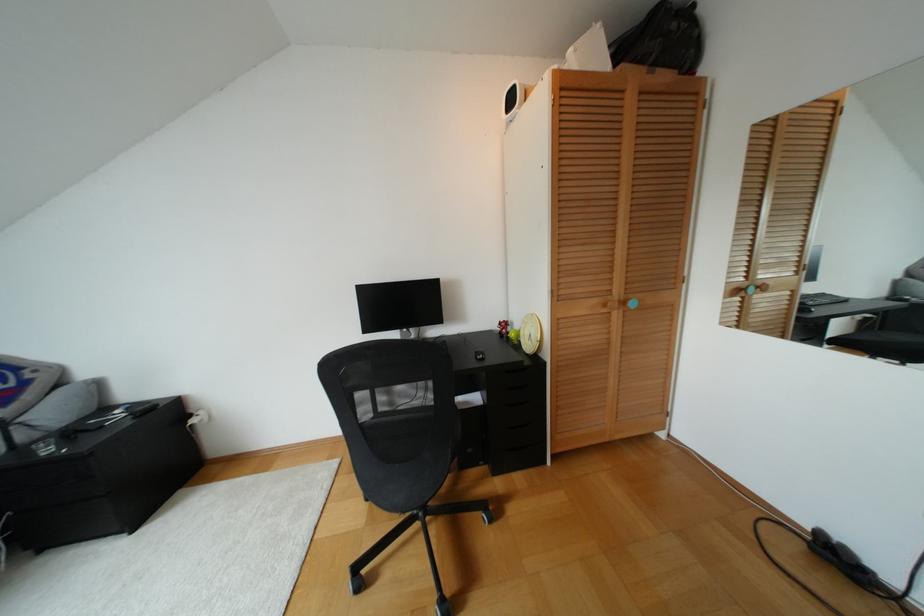
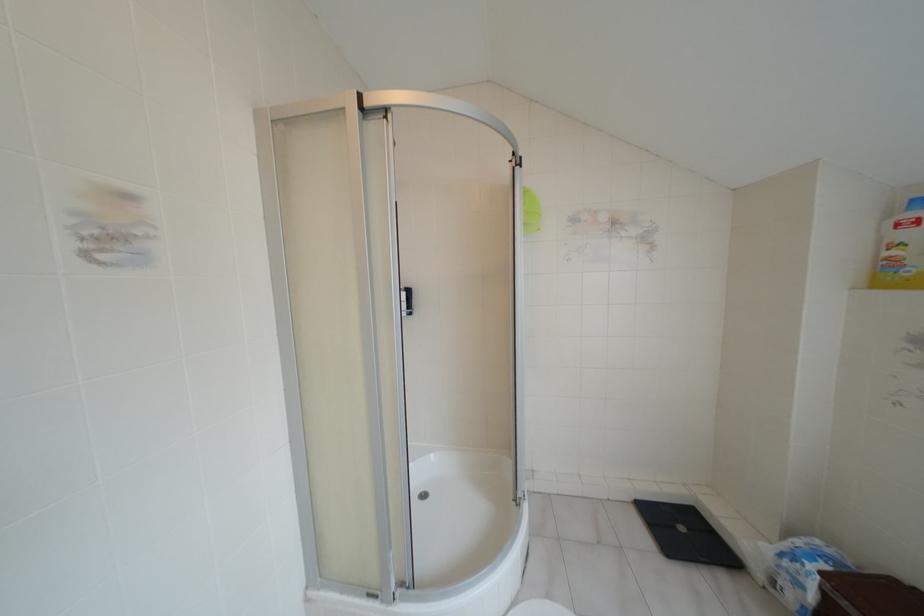
Question: Which direction would the cameraman need to move to produce the second image? Reply with the corresponding letter.

Choices:
 (A) Left
 (B) Right
 (C) Forward
 (D) Backward

Answer: (B)